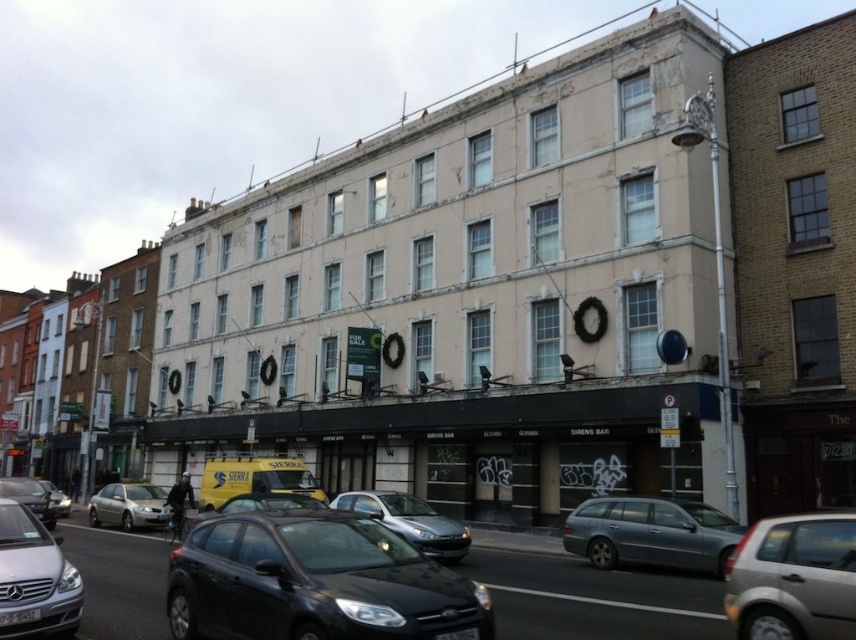
Based on the photo, is yellow matte van at center shorter than silver metallic sedan at center?

Yes, yellow matte van at center is shorter than silver metallic sedan at center.

The height and width of the screenshot is (640, 856). What do you see at coordinates (254, 477) in the screenshot? I see `yellow matte van at center` at bounding box center [254, 477].

Is point (282, 467) in front of point (105, 484)?

Yes.

This screenshot has width=856, height=640. I want to click on yellow matte van at center, so click(x=254, y=477).

Is yellow matte van at center positioned in front of shiny black sedan at center?

No, it is behind shiny black sedan at center.

The width and height of the screenshot is (856, 640). Find the location of `yellow matte van at center`. yellow matte van at center is located at coordinates (254, 477).

Who is more distant from viewer, (x=236, y=461) or (x=263, y=492)?

The point (x=236, y=461) is more distant.

This screenshot has width=856, height=640. What are the coordinates of `yellow matte van at center` in the screenshot? It's located at (254, 477).

How much distance is there between satin silver car at center and metallic silver car at lower left?

A distance of 16.19 meters exists between satin silver car at center and metallic silver car at lower left.

Does satin silver car at center have a greater height compared to metallic silver car at lower left?

No.

Describe the element at coordinates (409, 522) in the screenshot. I see `satin silver car at center` at that location.

Identify the location of satin silver car at center. (x=409, y=522).